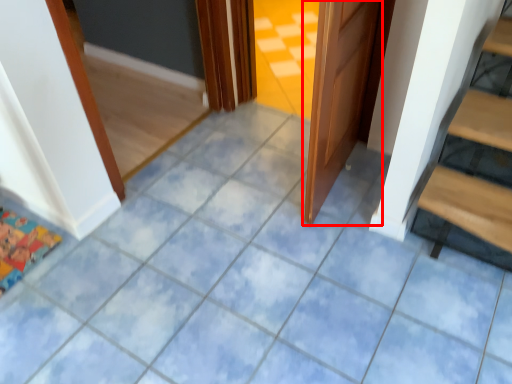
Question: Where is door (annotated by the red box) located in relation to doormat in the image?

Choices:
 (A) left
 (B) right

Answer: (B)